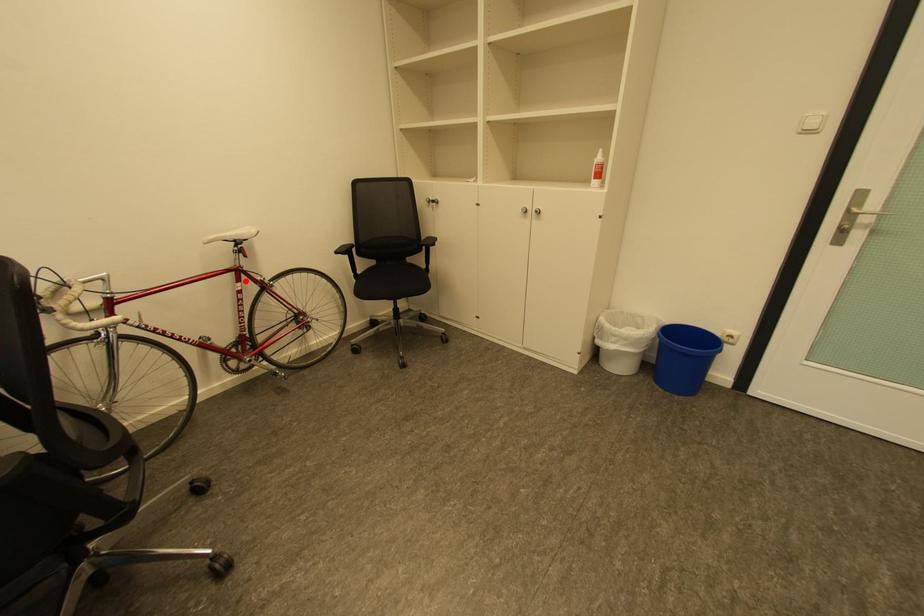
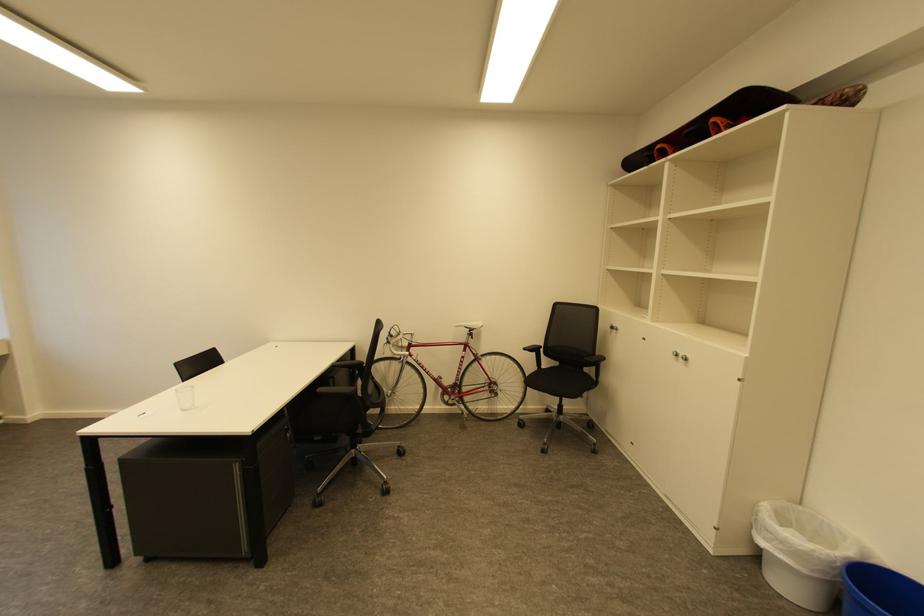
Question: I am providing you with two images of the same scene from different viewpoints. A red point is shown in image1. For the corresponding object point in image2, is it positioned nearer or farther from the camera?

Choices:
 (A) Nearer
 (B) Farther

Answer: (B)